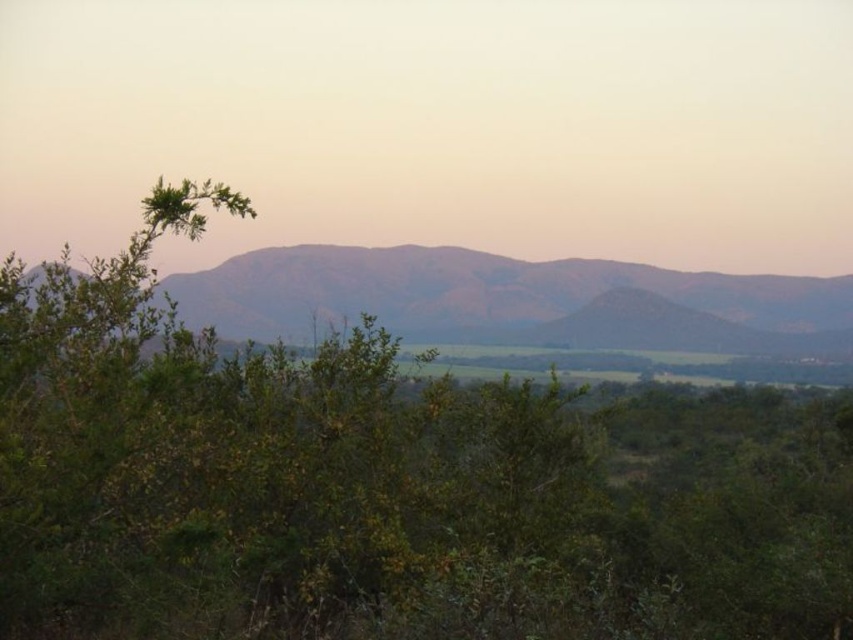
Between green leafy bush at center and dull brown mountain range at center, which one is positioned higher?

dull brown mountain range at center is higher up.

Does point (584, 467) come in front of point (474, 280)?

Yes, point (584, 467) is closer to viewer.

Locate an element on the screen. green leafy bush at center is located at coordinates (369, 488).